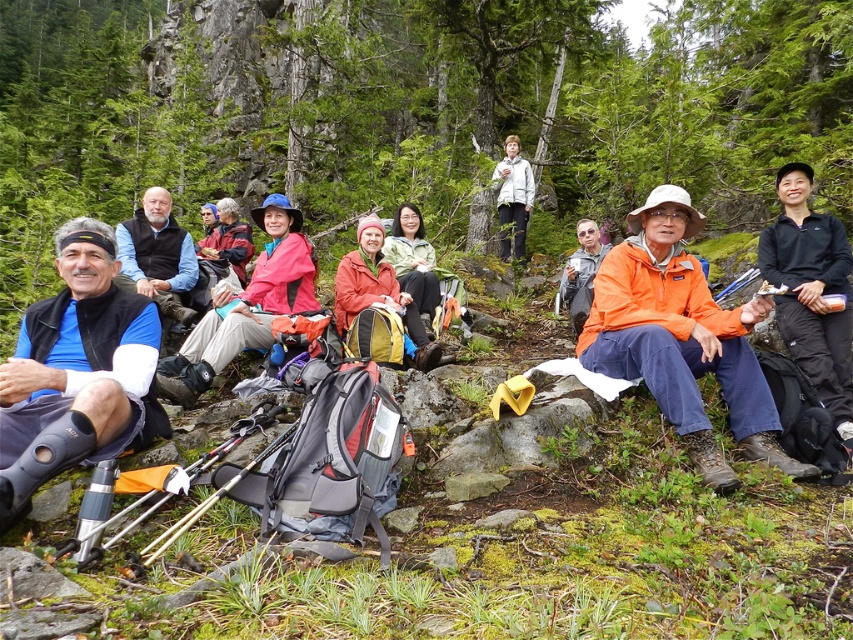
Question: Is matte pink jacket at center closer to camera compared to light gray jacket at center?

Choices:
 (A) yes
 (B) no

Answer: (A)

Question: Which of the following is the closest to the observer?

Choices:
 (A) (288, 291)
 (B) (506, 182)
 (C) (368, 291)

Answer: (A)

Question: Can you confirm if matte orange jacket at center is smaller than light gray jacket at center?

Choices:
 (A) no
 (B) yes

Answer: (B)

Question: Which object is farther from the camera taking this photo?

Choices:
 (A) light gray jacket at center
 (B) matte orange jacket at center

Answer: (A)

Question: Which of the following is the closest to the observer?

Choices:
 (A) (276, 300)
 (B) (531, 180)

Answer: (A)

Question: Is matte pink jacket at center in front of matte orange jacket at center?

Choices:
 (A) no
 (B) yes

Answer: (B)